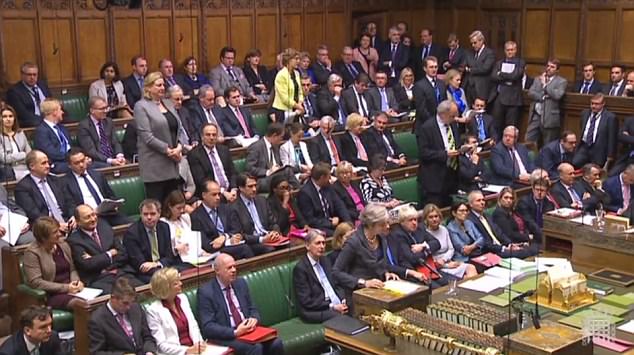
Identify the location of empty seats. Image resolution: width=634 pixels, height=355 pixels. click(278, 317), click(403, 190), click(403, 143), click(127, 186), click(257, 118), click(73, 104), click(117, 133).